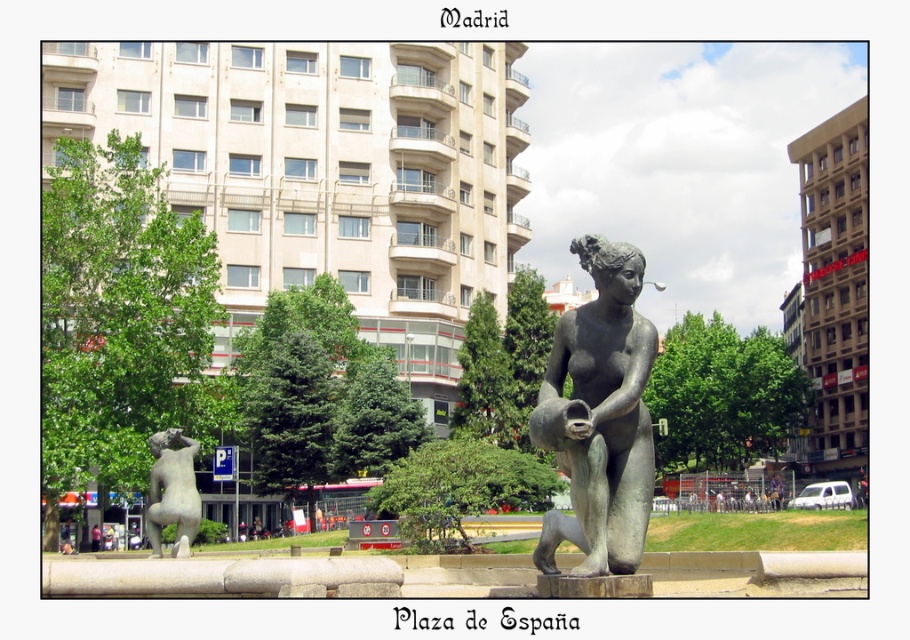
Does bronze statue at center appear under bronze statue at lower left?

Actually, bronze statue at center is above bronze statue at lower left.

Which is more to the right, bronze statue at center or bronze statue at lower left?

bronze statue at center is more to the right.

Does point (573, 529) come in front of point (199, 499)?

Yes, point (573, 529) is in front of point (199, 499).

This screenshot has height=640, width=910. I want to click on bronze statue at center, so click(599, 417).